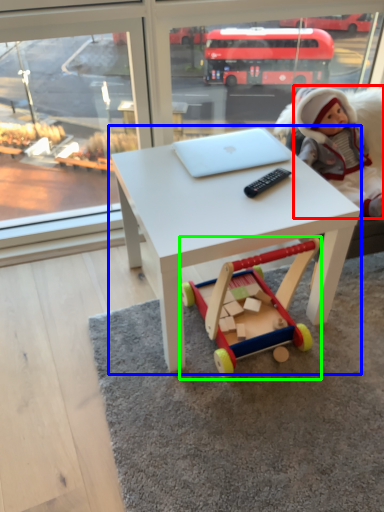
Question: Which is farther away from person (highlighted by a red box)? table (highlighted by a blue box) or toy (highlighted by a green box)?

Choices:
 (A) table
 (B) toy

Answer: (B)